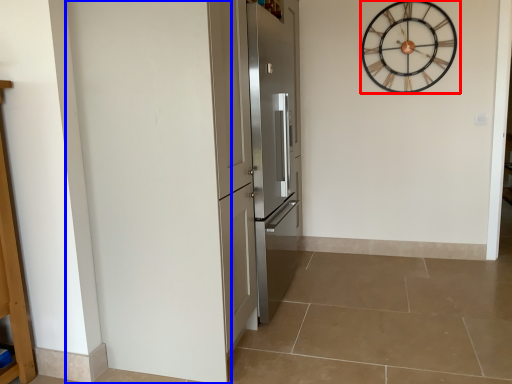
Question: Which object is further to the camera taking this photo, wall clock (highlighted by a red box) or door (highlighted by a blue box)?

Choices:
 (A) wall clock
 (B) door

Answer: (A)